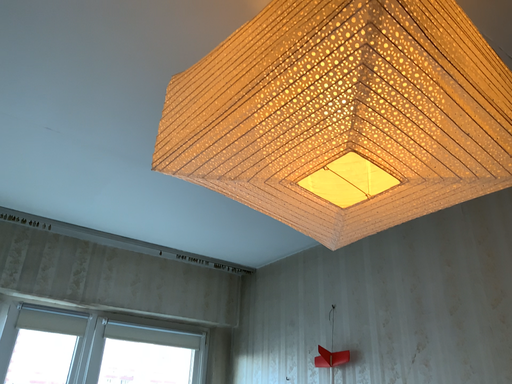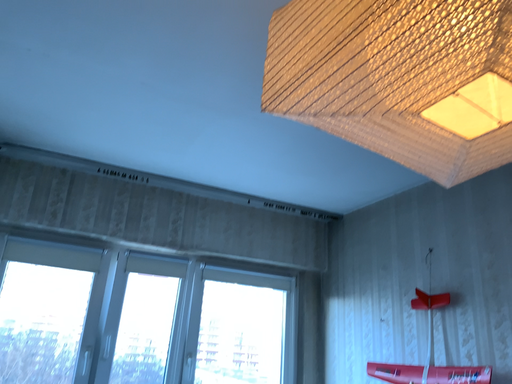
Question: How did the camera likely rotate when shooting the video?

Choices:
 (A) rotated right
 (B) rotated left

Answer: (B)